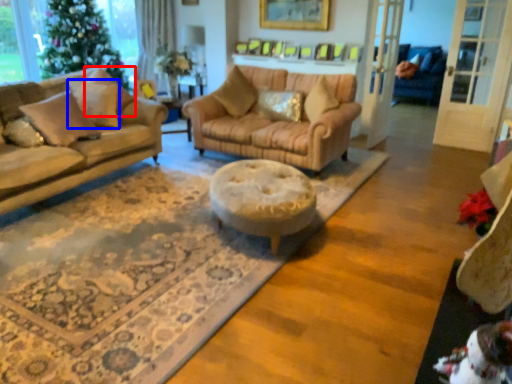
Question: Which object appears closest to the camera in this image, pillow (highlighted by a red box) or pillow (highlighted by a blue box)?

Choices:
 (A) pillow
 (B) pillow

Answer: (A)